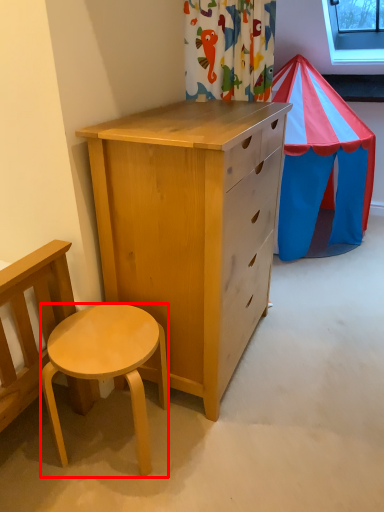
Question: From the image's perspective, what is the correct spatial positioning of desk (annotated by the red box) in reference to window screen?

Choices:
 (A) above
 (B) below

Answer: (B)